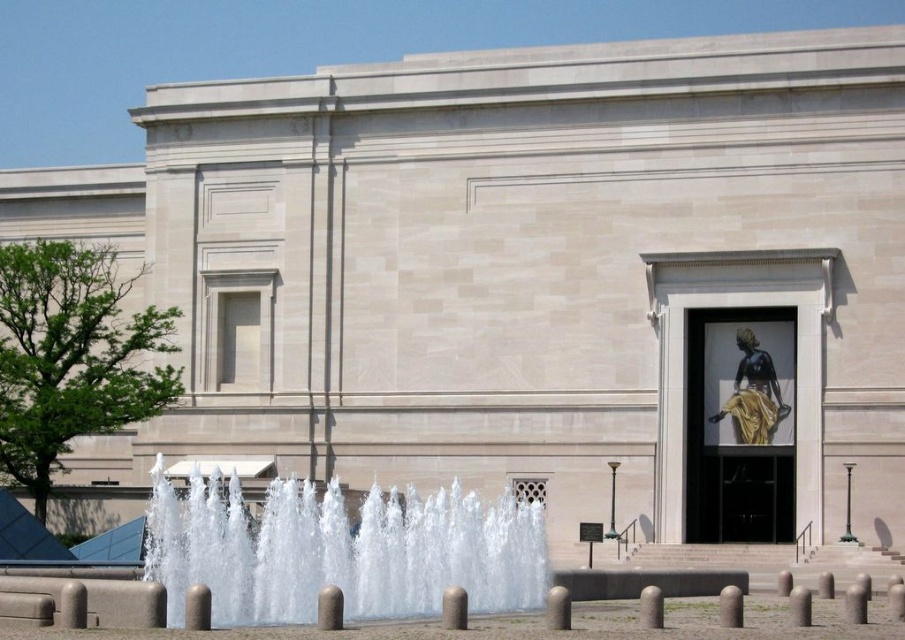
Between clear water at center and black polished statue at center, which one is positioned higher?

Positioned higher is black polished statue at center.

Does clear water at center appear on the right side of black polished statue at center?

No, clear water at center is not to the right of black polished statue at center.

You are a GUI agent. You are given a task and a screenshot of the screen. Output one action in this format:
    pyautogui.click(x=<x>, y=<y>)
    Task: Click on the clear water at center
    Image resolution: width=905 pixels, height=640 pixels.
    Given the screenshot: What is the action you would take?
    pyautogui.click(x=341, y=550)

Where is `clear water at center`? clear water at center is located at coordinates (341, 550).

Does clear water at center appear over smooth concrete bollard at lower center?

No.

Can you confirm if clear water at center is thinner than smooth concrete bollard at lower center?

No, clear water at center is not thinner than smooth concrete bollard at lower center.

The image size is (905, 640). Find the location of `clear water at center`. clear water at center is located at coordinates (341, 550).

Does point (772, 417) lie behind point (569, 628)?

Yes, point (772, 417) is behind point (569, 628).

Is black polished statue at center thinner than smooth concrete bollard at lower center?

In fact, black polished statue at center might be wider than smooth concrete bollard at lower center.

Between point (757, 352) and point (546, 593), which one is positioned in front?

Point (546, 593) is more forward.

Where is `black polished statue at center`? black polished statue at center is located at coordinates (749, 381).